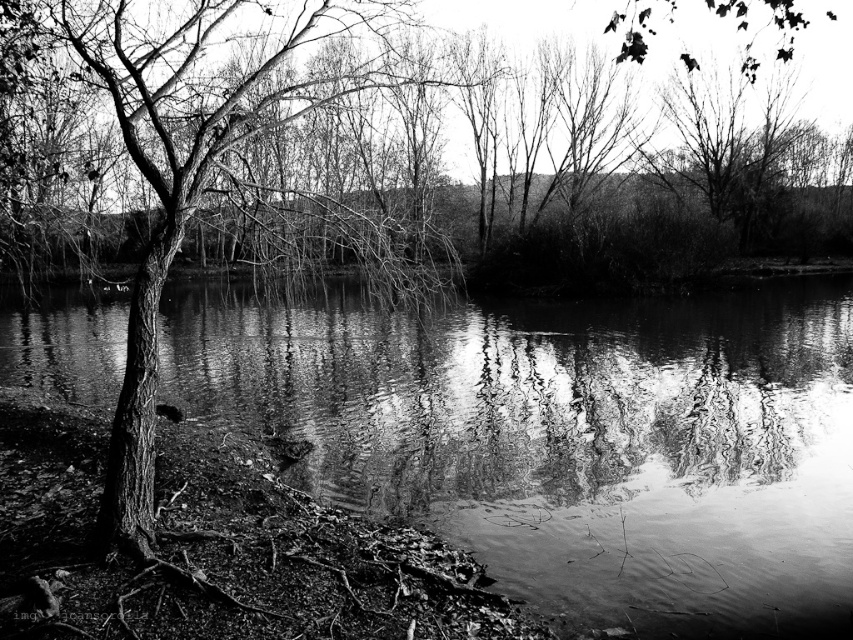
Consider the image. You are standing at the edge of the bank in the scene and want to reach the smooth water at center. Which direction should you move to get there?

The smooth water at center is located at point (566, 438), so you should move towards the center of the image to reach it.